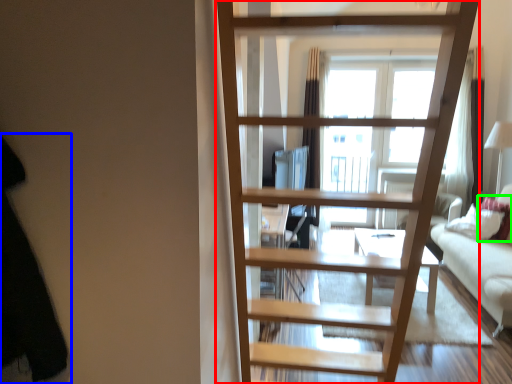
Question: Based on their relative distances, which object is nearer to ladder (highlighted by a red box)? Choose from dark (highlighted by a blue box) and pillow (highlighted by a green box).

Choices:
 (A) dark
 (B) pillow

Answer: (A)